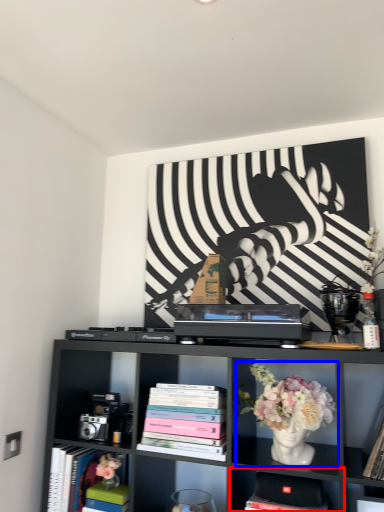
Question: Which point is further to the camera, shelf (highlighted by a red box) or floral arrangement (highlighted by a blue box)?

Choices:
 (A) shelf
 (B) floral arrangement

Answer: (A)